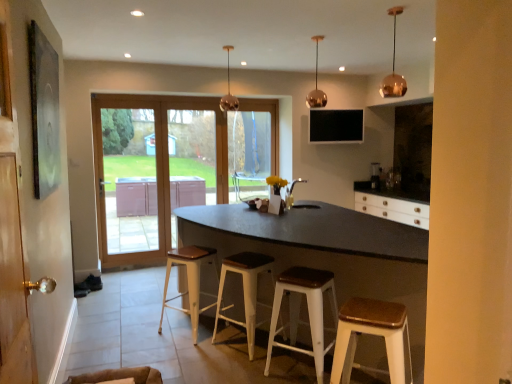
Question: Which direction should I rotate to look at white wood stool at center, placed as the fourth stool when sorted from front to back?

Choices:
 (A) left
 (B) right

Answer: (A)

Question: Is wooden door handle on the left closer to camera compared to metallic gold pendant light at upper center, placed as the first light fixture when sorted from back to front?

Choices:
 (A) yes
 (B) no

Answer: (A)

Question: Is wooden door handle on the left shorter than metallic gold pendant light at upper center, marked as the third light fixture in a right-to-left arrangement?

Choices:
 (A) yes
 (B) no

Answer: (B)

Question: Can you confirm if wooden door handle on the left is positioned to the right of metallic gold pendant light at upper center, marked as the third light fixture in a right-to-left arrangement?

Choices:
 (A) no
 (B) yes

Answer: (A)

Question: Does wooden door handle on the left have a smaller size compared to metallic gold pendant light at upper center, placed as the first light fixture when sorted from back to front?

Choices:
 (A) no
 (B) yes

Answer: (A)

Question: From the image's perspective, is wooden door handle on the left beneath metallic gold pendant light at upper center, arranged as the first light fixture when viewed from the left?

Choices:
 (A) yes
 (B) no

Answer: (A)

Question: Considering the relative sizes of wooden door handle on the left and metallic gold pendant light at upper center, placed as the first light fixture when sorted from back to front, in the image provided, is wooden door handle on the left taller than metallic gold pendant light at upper center, placed as the first light fixture when sorted from back to front,?

Choices:
 (A) yes
 (B) no

Answer: (A)

Question: Is gold metallic pendant light at upper center, the second light fixture positioned from the back, next to wooden door handle on the left?

Choices:
 (A) no
 (B) yes

Answer: (A)

Question: Does gold metallic pendant light at upper center, which appears as the 2th light fixture when viewed from the left, appear on the left side of wooden door handle on the left?

Choices:
 (A) no
 (B) yes

Answer: (A)

Question: Considering the relative sizes of gold metallic pendant light at upper center, the second light fixture positioned from the back, and wooden door handle on the left in the image provided, is gold metallic pendant light at upper center, the second light fixture positioned from the back, smaller than wooden door handle on the left?

Choices:
 (A) no
 (B) yes

Answer: (B)

Question: Considering the relative sizes of gold metallic pendant light at upper center, the second light fixture positioned from the back, and wooden door handle on the left in the image provided, is gold metallic pendant light at upper center, the second light fixture positioned from the back, wider than wooden door handle on the left?

Choices:
 (A) no
 (B) yes

Answer: (B)

Question: Is gold metallic pendant light at upper center, arranged as the 2th light fixture when viewed from the right, further to the viewer compared to wooden door handle on the left?

Choices:
 (A) no
 (B) yes

Answer: (B)

Question: Can you confirm if gold metallic pendant light at upper center, which appears as the 2th light fixture when viewed from the left, is shorter than wooden door handle on the left?

Choices:
 (A) yes
 (B) no

Answer: (A)

Question: Is transparent glass window at center far away from white wood stool at lower right, which ranks as the fourth stool in back-to-front order?

Choices:
 (A) no
 (B) yes

Answer: (B)